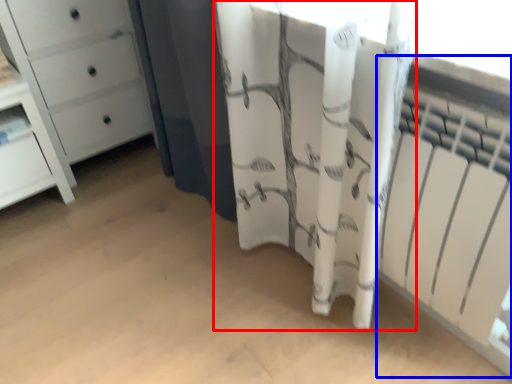
Question: Which point is further to the camera, curtain (highlighted by a red box) or radiator (highlighted by a blue box)?

Choices:
 (A) curtain
 (B) radiator

Answer: (B)